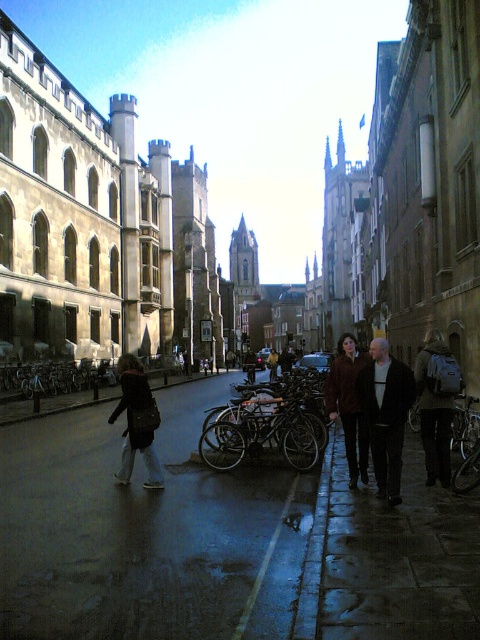
What is the exact location of the shiny concrete pavement at center in the image?

The shiny concrete pavement at center is located at point [145,532].

You are a delivery person who needs to carry both the denim jacket at lower left and the brown leather jacket at center. If you have a bag that can only hold items with a combined width of 1.2 meters, can you fit both jackets into the bag?

The denim jacket at lower left might be wider than brown leather jacket at center, but without knowing their exact widths, it is uncertain if their combined width exceeds 1.2 meters. You should check the actual measurements before deciding.